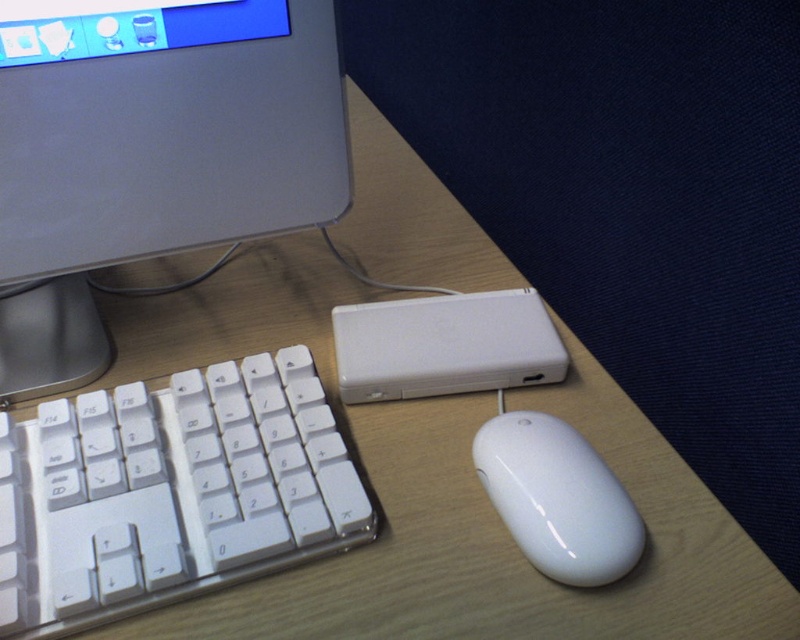
Can you confirm if satin silver monitor at upper left is taller than white plastic keyboard at lower left?

Correct, satin silver monitor at upper left is much taller as white plastic keyboard at lower left.

Where is `satin silver monitor at upper left`? The image size is (800, 640). satin silver monitor at upper left is located at coordinates (154, 157).

Which is in front, point (58, 92) or point (222, 522)?

Point (222, 522) is more forward.

The image size is (800, 640). I want to click on satin silver monitor at upper left, so click(154, 157).

Is white glossy mouse at lower right below matte plastic monitor at upper left?

Correct, white glossy mouse at lower right is located below matte plastic monitor at upper left.

In the scene shown: Who is more forward, (517, 426) or (174, 44)?

Positioned in front is point (174, 44).

Does point (500, 467) lie behind point (58, 28)?

Yes, point (500, 467) is behind point (58, 28).

Where is `white glossy mouse at lower right`? This screenshot has height=640, width=800. white glossy mouse at lower right is located at coordinates (558, 499).

Between point (5, 509) and point (626, 525), which one is positioned behind?

Point (5, 509)

This screenshot has height=640, width=800. In order to click on white plastic keyboard at lower left in this screenshot , I will do `click(169, 492)`.

This screenshot has width=800, height=640. I want to click on white plastic keyboard at lower left, so click(x=169, y=492).

This screenshot has width=800, height=640. What are the coordinates of `white plastic keyboard at lower left` in the screenshot? It's located at (169, 492).